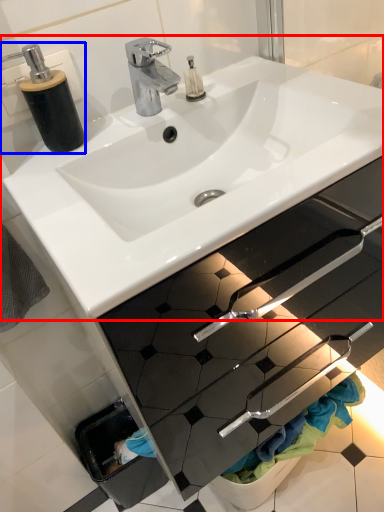
Question: Which point is closer to the camera, sink (highlighted by a red box) or soap dispenser (highlighted by a blue box)?

Choices:
 (A) sink
 (B) soap dispenser

Answer: (A)